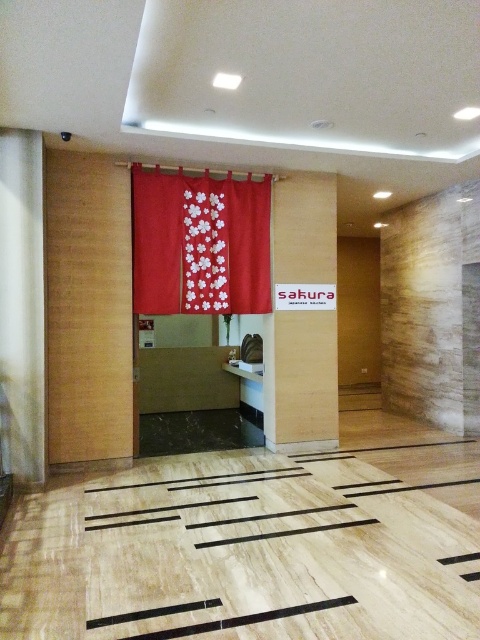
Does point (142, 173) come farther from viewer compared to point (303, 333)?

No.

Is red floral fabric curtain at center further to camera compared to wooden sign at center?

No, it is not.

Which is in front, point (241, 259) or point (284, 257)?

Point (241, 259)

Find the location of a particular element. The height and width of the screenshot is (640, 480). red floral fabric curtain at center is located at coordinates (200, 243).